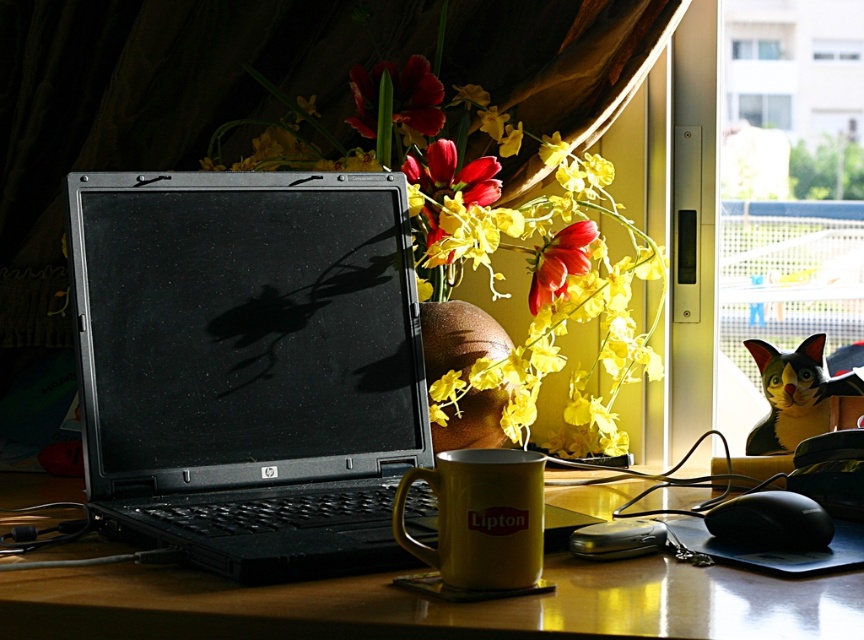
You are organizing the desk and need to place a new item between the matte plastic vase at center and the matte red flower at center. Based on their current positions, which object should you move to the left to create space?

The matte plastic vase at center is to the right of the matte red flower at center, so you should move the matte plastic vase at center to the left to create space between them.

From the picture: You are looking at the workspace setup from the front. There are two points labeled point (405, 170) and point (427, 108) on the desk. Which point is closer to you?

Point (405, 170) is closer to the camera than point (427, 108), so the point closer to you is point (405, 170).

You are organizing your desk and want to place a new keyboard between the black plastic laptop at center and the matte plastic vase at center. The keyboard is 10 inches wide. Do you think it will fit between them?

The black plastic laptop at center and the matte plastic vase at center are 8.79 inches apart. Since the keyboard is 10 inches wide, it will not fit between them as the distance is smaller than the keyboard.